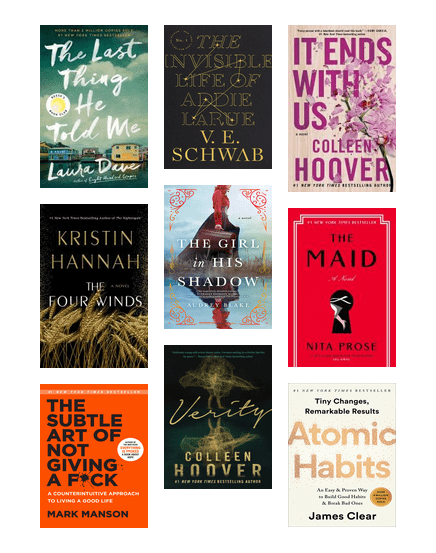
Find the location of `book`. book is located at coordinates (105, 121), (221, 98), (354, 117), (112, 260), (237, 254), (333, 279), (95, 444), (214, 415), (326, 435).